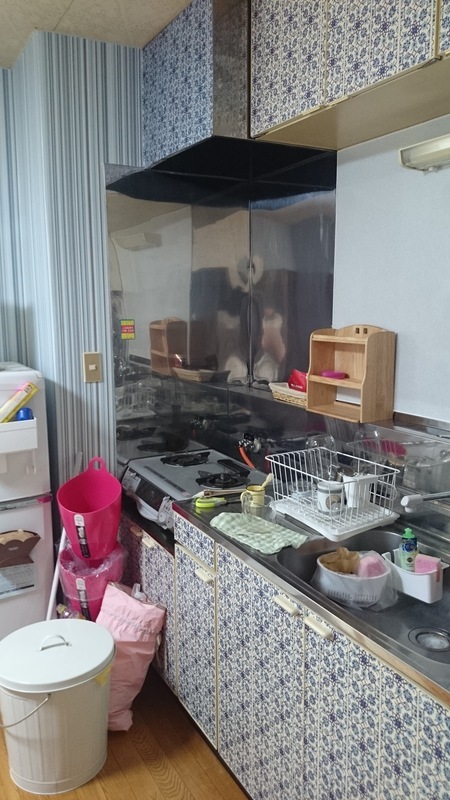
Identify the location of floor in front of cabinets. (163, 756).